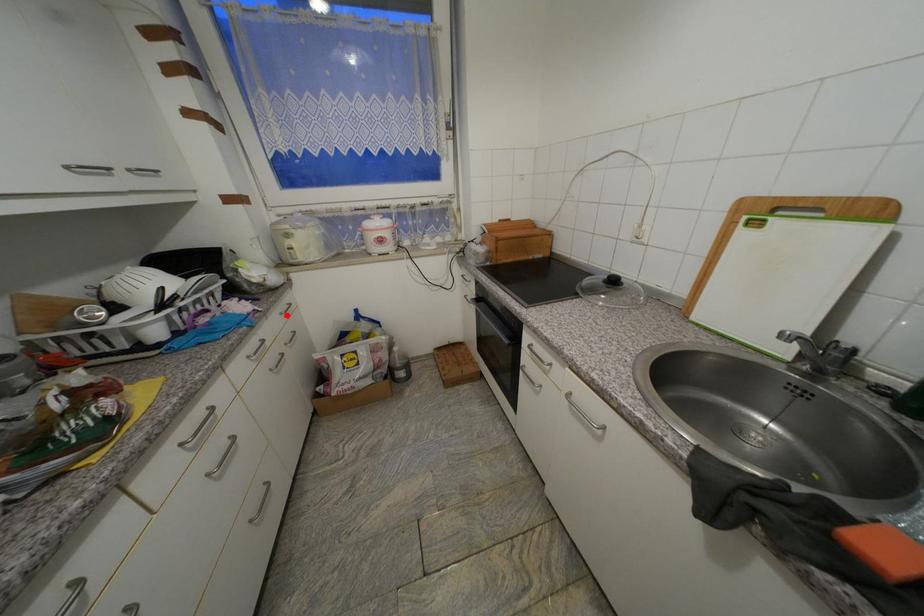
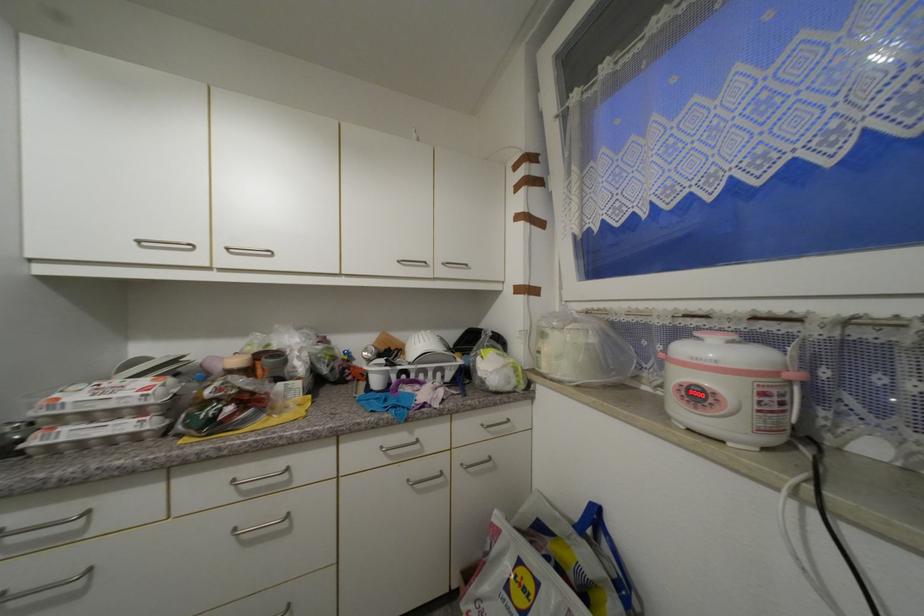
The point at the highlighted location is marked in the first image. Where is the corresponding point in the second image?

(488, 427)